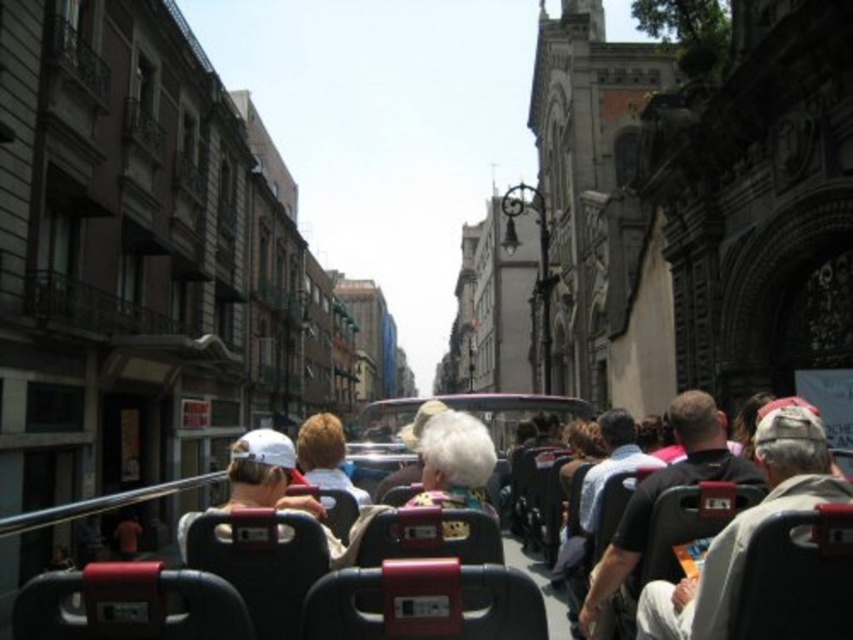
You are a tour guide on a bus and want to point out the white fabric at center and the black leather coach at center to your passengers. Which one is closer to the left side of the bus?

The white fabric at center is to the left of the black leather coach at center, so the white fabric at center is closer to the left side of the bus.

You are a passenger on the tour bus and want to take a photo of both the white fabric at center and the black leather coach at center. Which object should you focus on first to ensure both are in the frame?

The white fabric at center is closer to the viewer than the black leather coach at center, so you should focus on the white fabric at center first to ensure both are in the frame.

You are a tour guide on the bus and want to show tourists the white fabric at center and the black leather coach at center through the bus window. Which object will appear larger in their view?

The black leather coach at center will appear larger in their view because it is bigger than the white fabric at center.